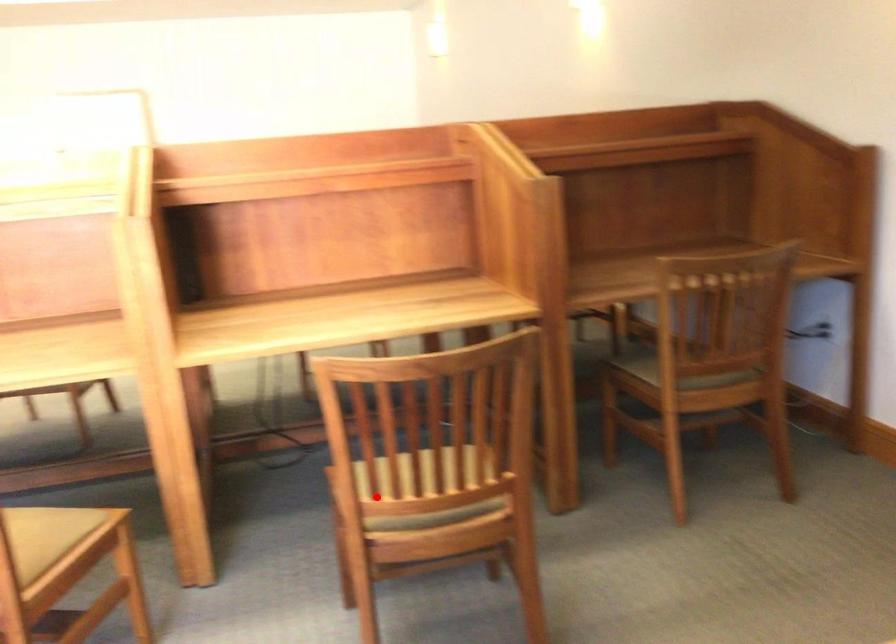
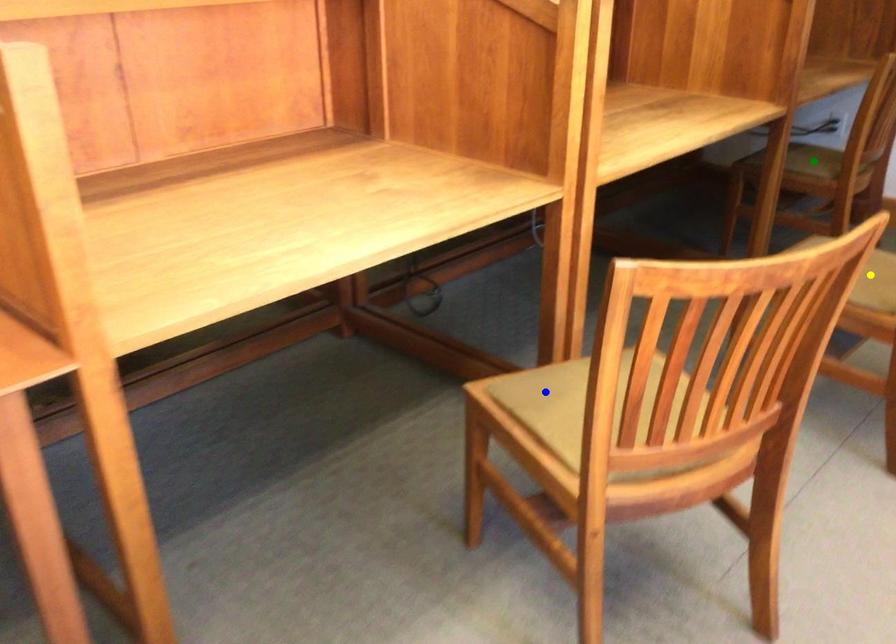
Question: I am providing you with two images of the same scene from different viewpoints. A red point is marked on the first image. You are given multiple points on the second image. Which point in image 2 represents the same 3d spot as the red point in image 1?

Choices:
 (A) green point
 (B) yellow point
 (C) blue point

Answer: (B)